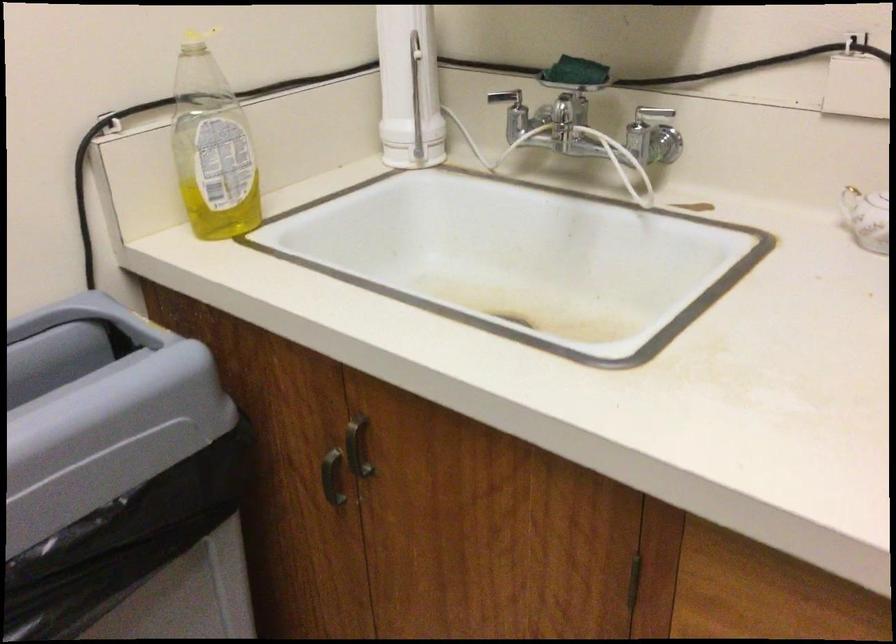
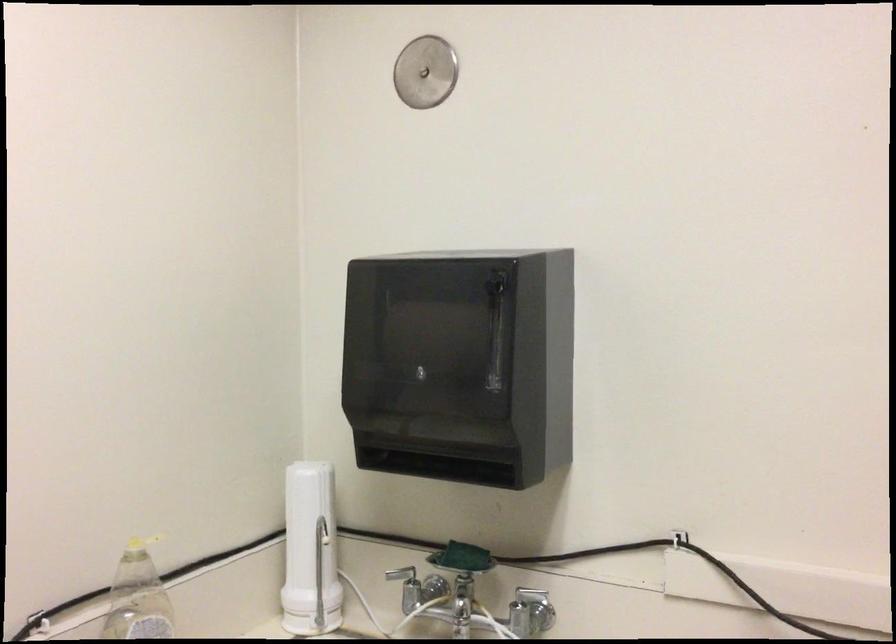
Find the pixel in the second image that matches (x=407, y=79) in the first image.

(309, 551)